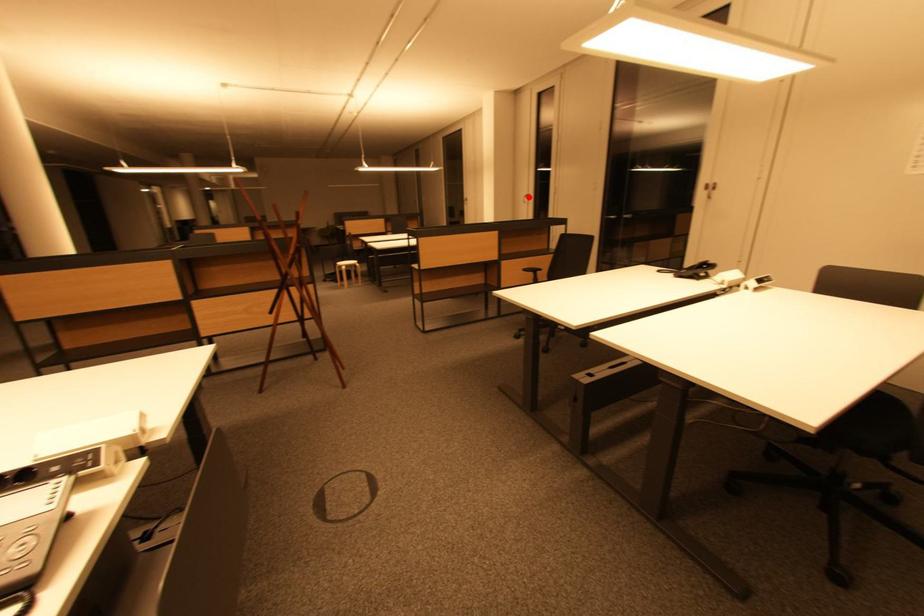
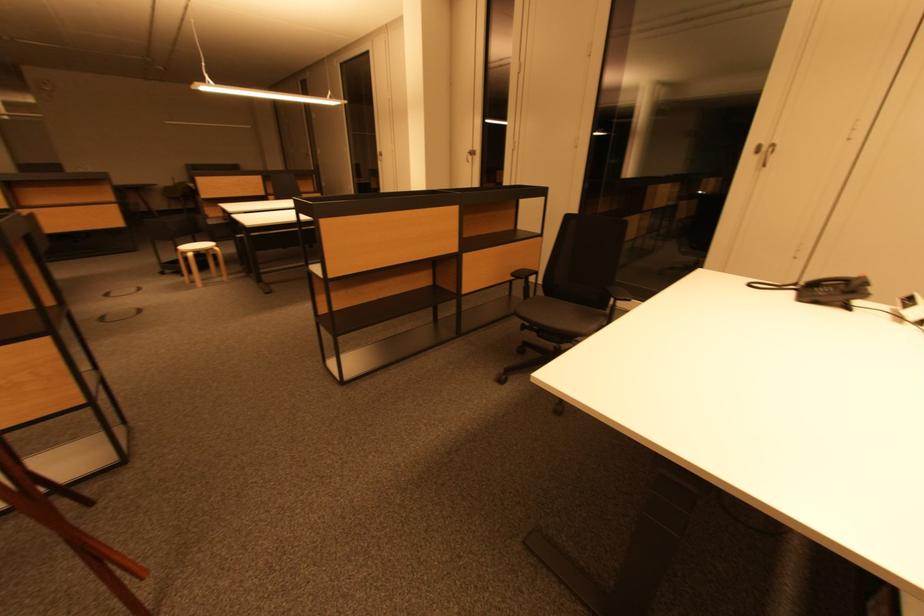
Locate, in the second image, the point that corresponds to the highlighted location in the first image.

(470, 152)